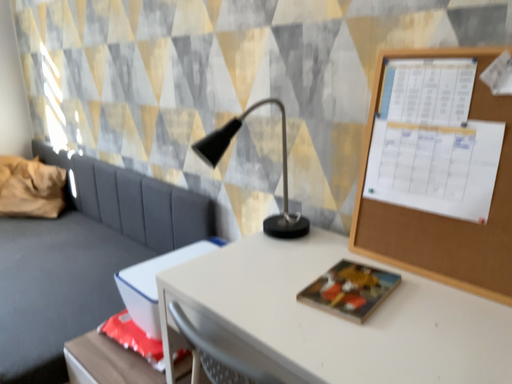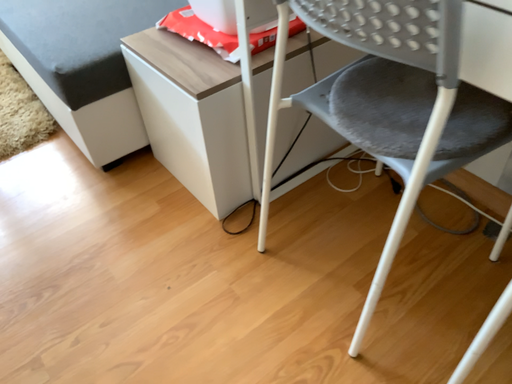
Question: Which way did the camera rotate in the video?

Choices:
 (A) rotated left
 (B) rotated right

Answer: (A)